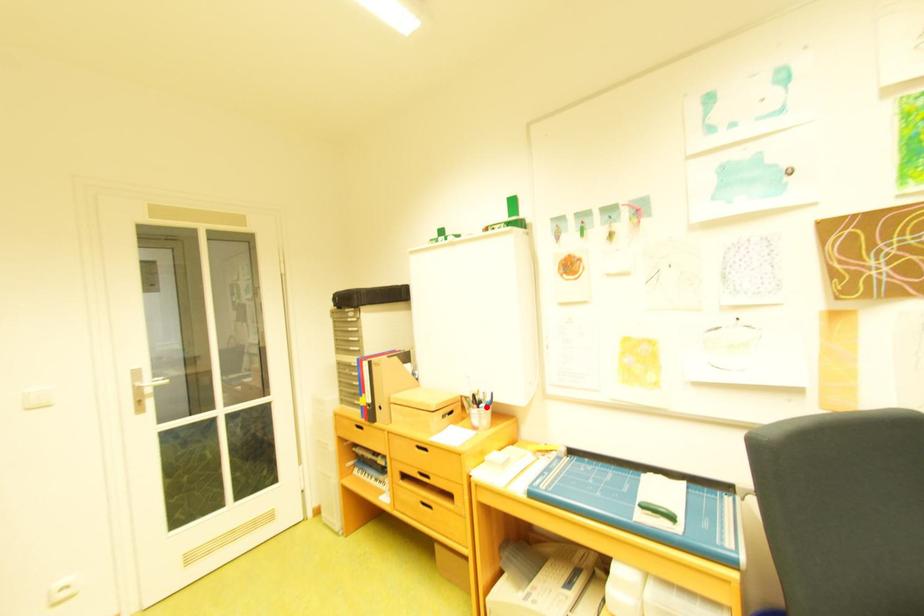
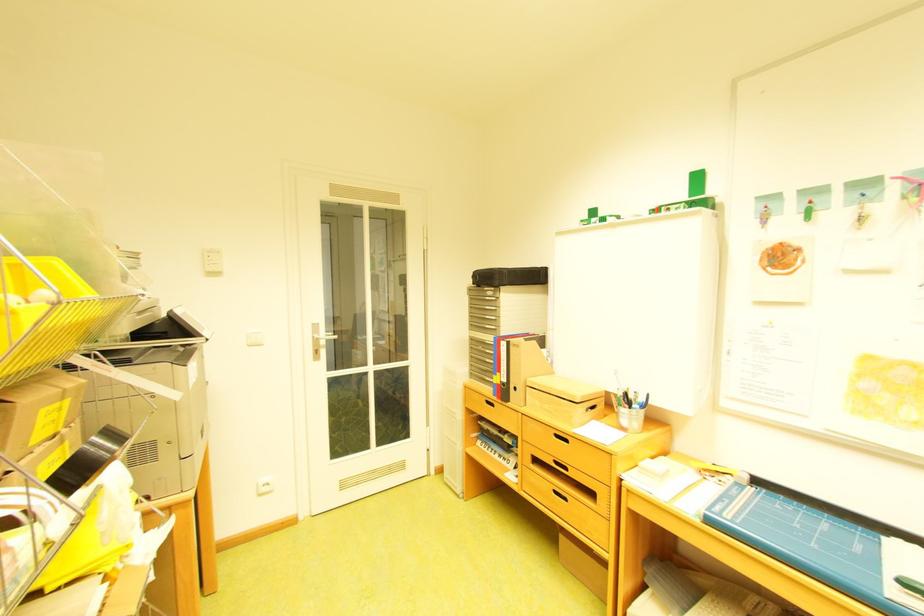
Locate, in the second image, the point that corresponds to the highlighted location in the first image.

(638, 407)